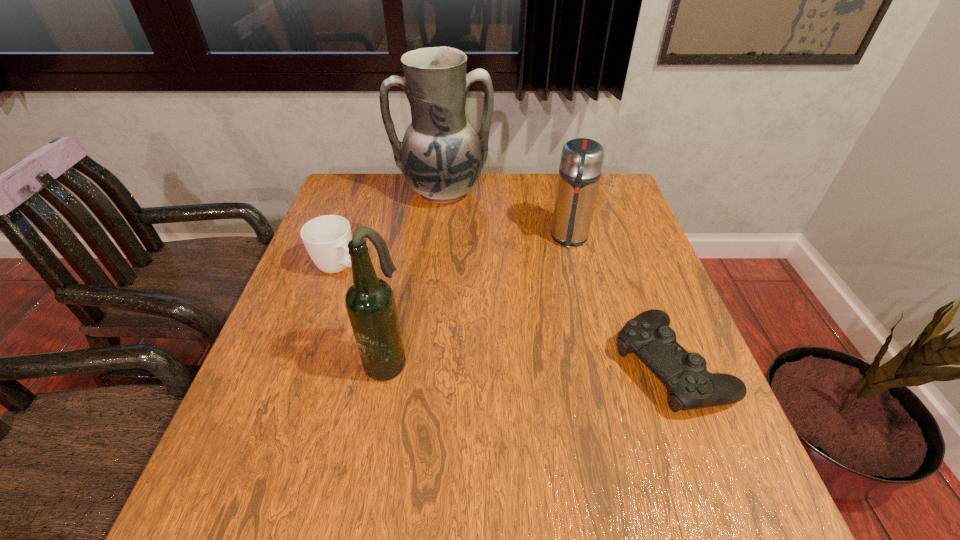
What are the coordinates of `vacant area between the second tallest object and the third tallest object` in the screenshot? It's located at (478, 299).

What are the coordinates of `free space between the second shortest object and the farthest object` in the screenshot? It's located at (392, 230).

This screenshot has width=960, height=540. I want to click on free space between the fourth shortest object and the third shortest object, so click(478, 299).

Find the location of a particular element. vacant point located between the third tallest object and the shortest object is located at coordinates (620, 301).

The image size is (960, 540). What are the coordinates of `free space between the beer bottle and the control` in the screenshot? It's located at (529, 363).

The height and width of the screenshot is (540, 960). Find the location of `vacant space in between the control and the thermos bottle`. vacant space in between the control and the thermos bottle is located at coordinates (620, 301).

Identify the location of unoccupied area between the fourth tallest object and the third tallest object. This screenshot has width=960, height=540. (455, 252).

Identify the location of vacant area that lies between the third shortest object and the beer bottle. The height and width of the screenshot is (540, 960). (478, 299).

This screenshot has width=960, height=540. I want to click on vacant point located between the pitcher and the fourth shortest object, so click(x=415, y=276).

Locate an element on the screen. the fourth closest object to the beer bottle is located at coordinates (441, 157).